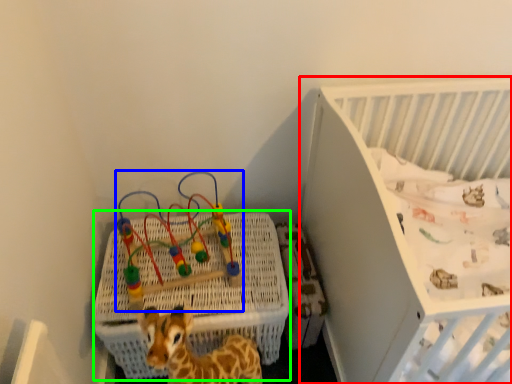
Question: Which object is positioned farthest from infant bed (highlighted by a red box)? Select from toy (highlighted by a blue box) and crate (highlighted by a green box).

Choices:
 (A) toy
 (B) crate

Answer: (A)